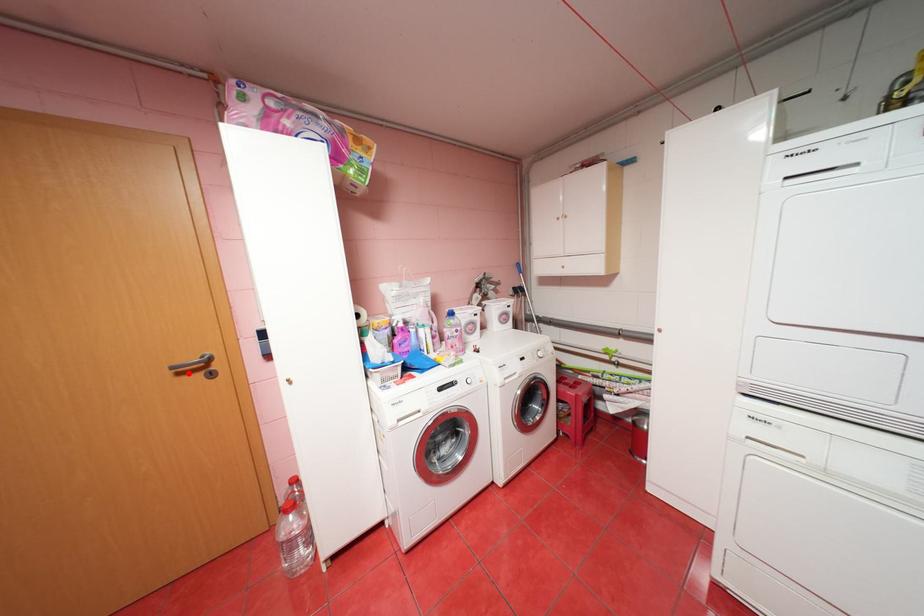
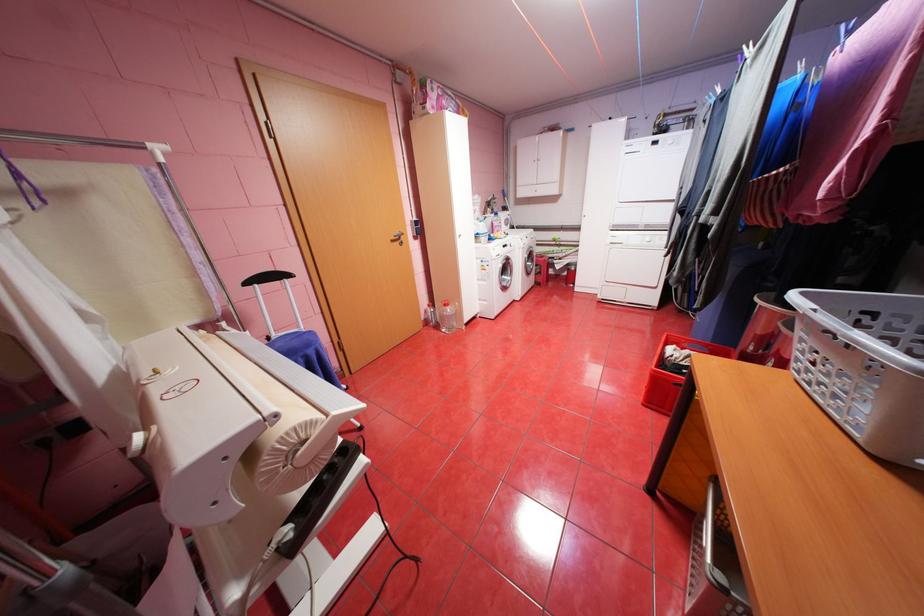
In the second image, find the point that corresponds to the highlighted location in the first image.

(400, 241)